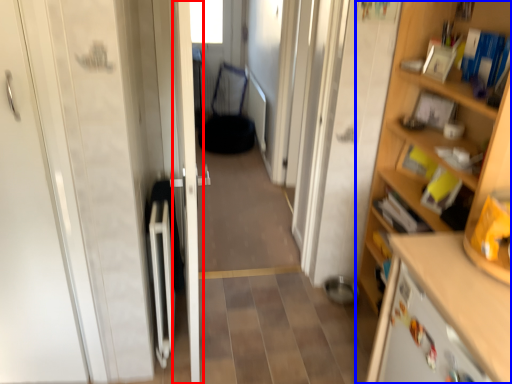
Question: Among these objects, which one is farthest to the camera, door (highlighted by a red box) or cupboard (highlighted by a blue box)?

Choices:
 (A) door
 (B) cupboard

Answer: (A)